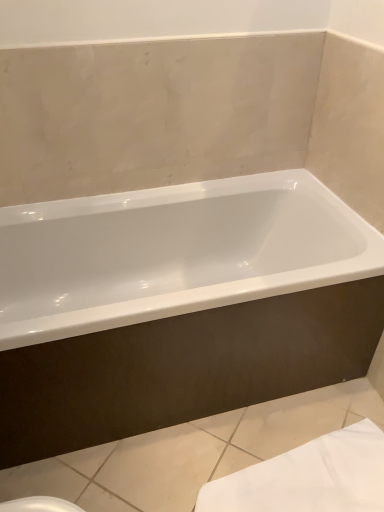
Question: Is white glossy bathtub at center at the right side of white fabric towel at lower right?

Choices:
 (A) yes
 (B) no

Answer: (B)

Question: Is white glossy bathtub at center turned away from white fabric towel at lower right?

Choices:
 (A) yes
 (B) no

Answer: (B)

Question: From the image's perspective, is white glossy bathtub at center below white fabric towel at lower right?

Choices:
 (A) no
 (B) yes

Answer: (A)

Question: From a real-world perspective, is white glossy bathtub at center over white fabric towel at lower right?

Choices:
 (A) no
 (B) yes

Answer: (B)

Question: From a real-world perspective, is white glossy bathtub at center physically below white fabric towel at lower right?

Choices:
 (A) yes
 (B) no

Answer: (B)

Question: Could you tell me if white glossy bathtub at center is facing white fabric towel at lower right?

Choices:
 (A) no
 (B) yes

Answer: (B)

Question: From a real-world perspective, is white fabric towel at lower right on top of white glossy bathtub at center?

Choices:
 (A) yes
 (B) no

Answer: (B)

Question: From the image's perspective, is white fabric towel at lower right under white glossy bathtub at center?

Choices:
 (A) no
 (B) yes

Answer: (B)

Question: Could you tell me if white fabric towel at lower right is facing white glossy bathtub at center?

Choices:
 (A) no
 (B) yes

Answer: (A)

Question: Does white fabric towel at lower right lie behind white glossy bathtub at center?

Choices:
 (A) yes
 (B) no

Answer: (A)

Question: From a real-world perspective, does white fabric towel at lower right sit lower than white glossy bathtub at center?

Choices:
 (A) no
 (B) yes

Answer: (B)

Question: Does white fabric towel at lower right contain white glossy bathtub at center?

Choices:
 (A) yes
 (B) no

Answer: (B)

Question: Based on their sizes in the image, would you say white glossy bathtub at center is bigger or smaller than white fabric towel at lower right?

Choices:
 (A) big
 (B) small

Answer: (A)